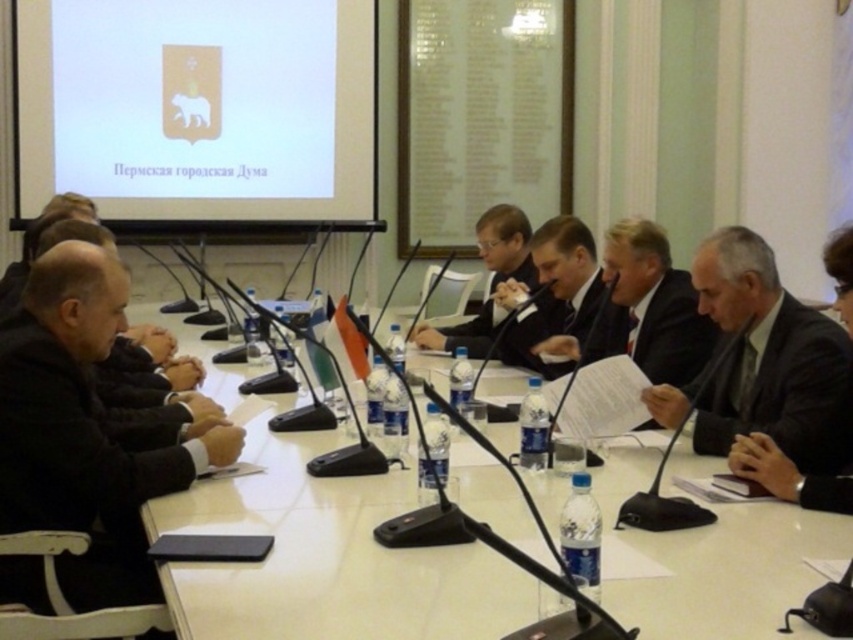
Based on the photo, you are a photographer standing at the camera position. You need to take a closeup photo of the black suit at left without moving the subject. Can you do it with your current camera setup which has a maximum zoom range of 1.5 meters?

The black suit at left is 1.77 meters from the camera. Since the camera can only zoom up to 1.5 meters, it cannot capture a closeup of the black suit at left without moving closer or using a different lens.

You are a security guard in the room. You need to check the distance between the white glossy table at center and the white glossy coat of arms at upper center. Can you confirm if it is more than 9 feet?

The white glossy table at center is 9.53 feet away from the white glossy coat of arms at upper center, so yes, the distance is more than 9 feet.

You are a photographer at the conference and need to position yourself so that both the black suit at left and the matte black suit at center are in frame. Based on their positions, which direction should you move to ensure both are visible?

You should move to the right side of the room to ensure both the black suit at left and the matte black suit at center are visible, as the black suit at left is to the left of the matte black suit at center.